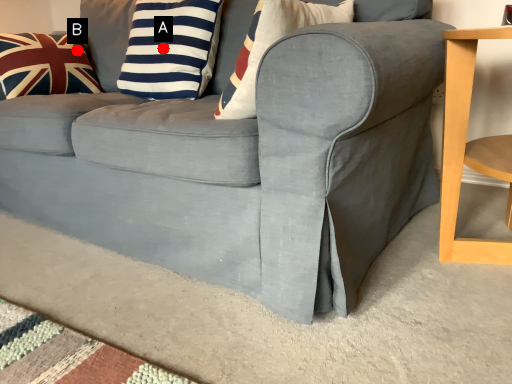
Question: Two points are circled on the image, labeled by A and B beside each circle. Which point is closer to the camera?

Choices:
 (A) A is closer
 (B) B is closer

Answer: (A)